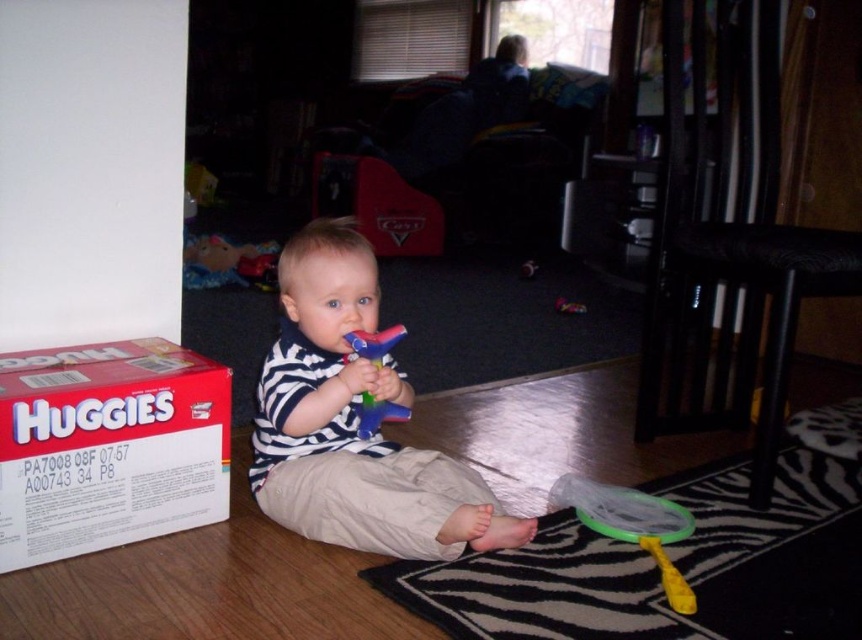
You are a parent trying to organize the play area. You want to place the striped fabric shirt at center and the red cardboard box at lower left on a shelf. Which object should you place first if you want to put the taller item on the lower shelf?

The striped fabric shirt at center is much taller than the red cardboard box at lower left, so you should place the striped fabric shirt at center first on the lower shelf.

You are a parent trying to locate two points in the room where you can place a small plant. The first point is at coordinates point [10,376] and the second at point [370,403]. From your perspective standing at the entrance of the room, which point is closer to you?

Point [10,376] is in front of point [370,403], so from your perspective at the entrance, point [10,376] is closer to you.